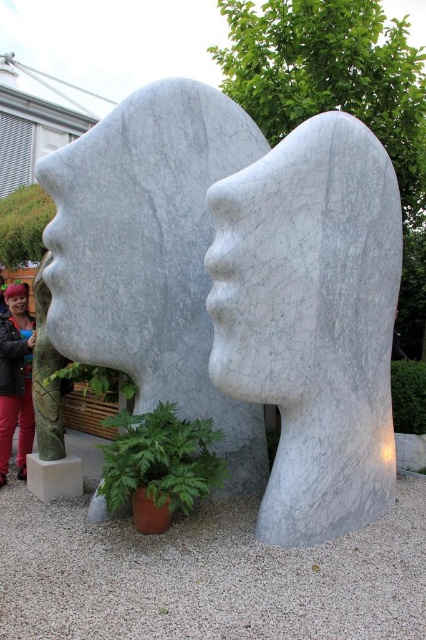
Question: Which point is farther from the camera taking this photo?

Choices:
 (A) (11, 428)
 (B) (11, 310)

Answer: (B)

Question: Is white marble sculpture at center behind matte black jacket at lower left?

Choices:
 (A) yes
 (B) no

Answer: (B)

Question: Does matte black jacket at lower left come in front of blonde hair at center?

Choices:
 (A) yes
 (B) no

Answer: (A)

Question: Based on their relative distances, which object is nearer to the white marble sculpture at center?

Choices:
 (A) matte black jacket at lower left
 (B) blonde hair at center

Answer: (A)

Question: Which of these objects is positioned farthest from the white marble sculpture at center?

Choices:
 (A) blonde hair at center
 (B) matte black jacket at lower left

Answer: (A)

Question: Considering the relative positions of white marble sculpture at center and blonde hair at center in the image provided, where is white marble sculpture at center located with respect to blonde hair at center?

Choices:
 (A) left
 (B) right

Answer: (B)